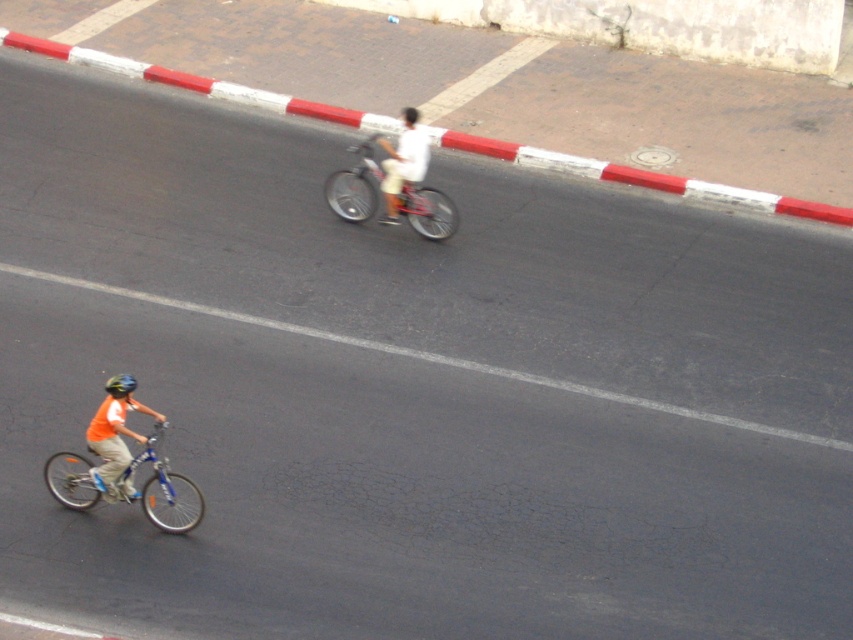
Question: Among these points, which one is farthest from the camera?

Choices:
 (A) (426, 216)
 (B) (91, 506)

Answer: (A)

Question: Does white matte shirt at center have a smaller size compared to shiny black helmet at lower left?

Choices:
 (A) yes
 (B) no

Answer: (B)

Question: Which object is closer to the camera taking this photo?

Choices:
 (A) blue metallic bicycle at lower left
 (B) orange t-shirt at left

Answer: (A)

Question: Can you confirm if blue metallic bicycle at lower left is wider than white matte shirt at center?

Choices:
 (A) no
 (B) yes

Answer: (B)

Question: Considering the relative positions of metallic silver bicycle at center and white matte shirt at center in the image provided, where is metallic silver bicycle at center located with respect to white matte shirt at center?

Choices:
 (A) above
 (B) below

Answer: (B)

Question: Which object is the farthest from the white matte shirt at center?

Choices:
 (A) blue metallic bicycle at lower left
 (B) shiny black helmet at lower left

Answer: (A)